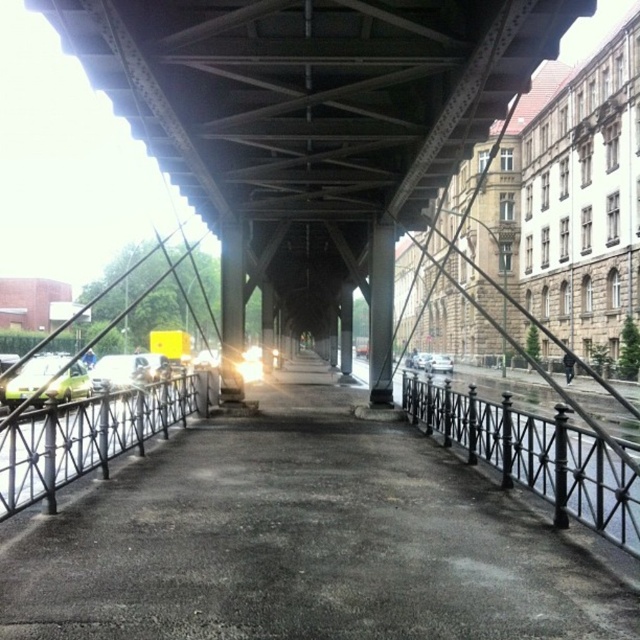
Can you confirm if metallic gray bridge at center is positioned to the left of silver metallic car at center?

Indeed, metallic gray bridge at center is positioned on the left side of silver metallic car at center.

This screenshot has height=640, width=640. What do you see at coordinates (310, 109) in the screenshot?
I see `metallic gray bridge at center` at bounding box center [310, 109].

Is point (216, 12) closer to camera compared to point (440, 371)?

That is True.

Locate an element on the screen. This screenshot has width=640, height=640. metallic gray bridge at center is located at coordinates (310, 109).

Between green matte car at left and shiny silver car at center, which one is positioned higher?

green matte car at left is above.

Does point (19, 394) lie behind point (138, 378)?

That is False.

The width and height of the screenshot is (640, 640). Find the location of `green matte car at left`. green matte car at left is located at coordinates (32, 378).

What are the coordinates of `green matte car at left` in the screenshot? It's located at (32, 378).

Is green matte car at left above silver metallic car at center?

Yes, green matte car at left is above silver metallic car at center.

Is green matte car at left smaller than silver metallic car at center?

Actually, green matte car at left might be larger than silver metallic car at center.

In order to click on green matte car at left in this screenshot , I will do `click(32, 378)`.